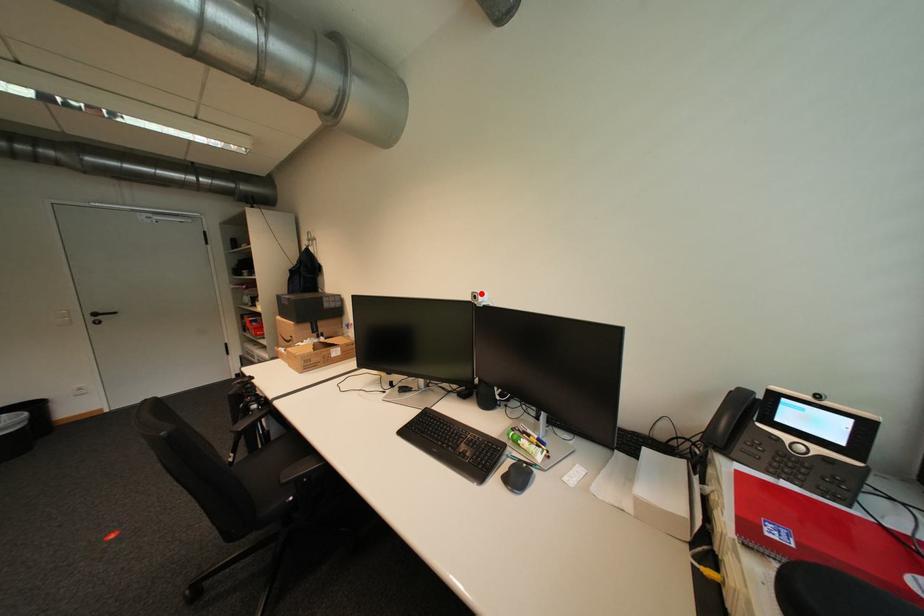
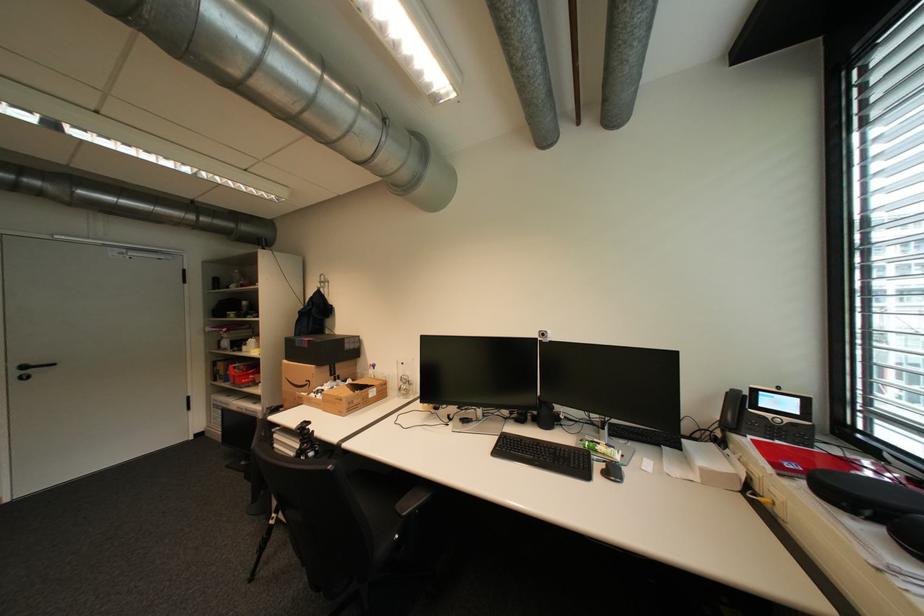
Where in the second image is the point corresponding to the highlighted location from the first image?

(548, 331)